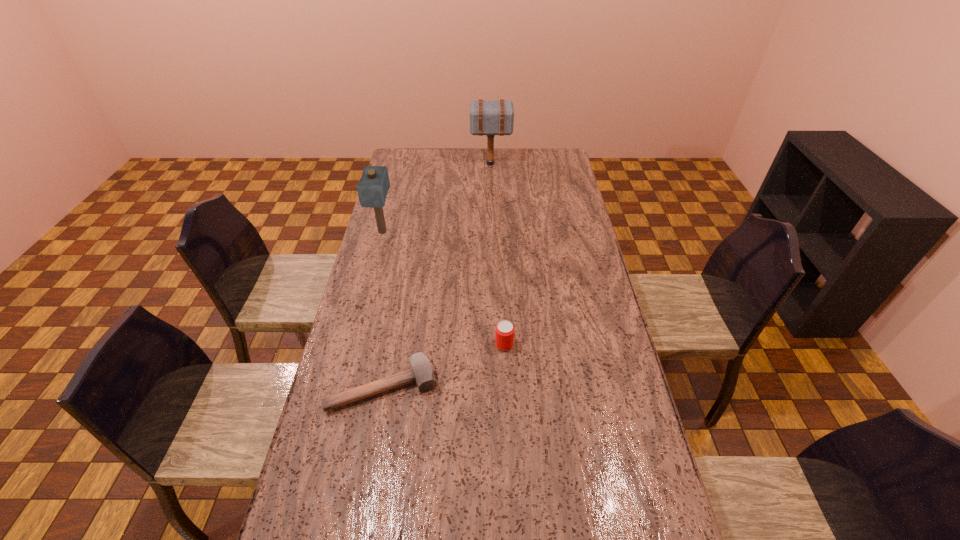
In order to click on vacant space situated on the back of the second farthest object in this screenshot , I will do `click(394, 190)`.

Identify the location of vacant region located on the back of the beer can. The height and width of the screenshot is (540, 960). (502, 307).

Locate an element on the screen. This screenshot has height=540, width=960. free space located on the right of the nearest mallet is located at coordinates (510, 387).

At what (x,y) coordinates should I click in order to perform the action: click on object located in the far edge section of the desktop. Please return your answer as a coordinate pair (x, y). The width and height of the screenshot is (960, 540). Looking at the image, I should click on [487, 117].

Find the location of a particular element. The width and height of the screenshot is (960, 540). vacant space at the far edge of the desktop is located at coordinates (444, 167).

In the image, there is a desktop. Where is `vacant space at the left edge`? vacant space at the left edge is located at coordinates (390, 179).

In the image, there is a desktop. What are the coordinates of `vacant area at the right edge` in the screenshot? It's located at (555, 218).

Locate an element on the screen. This screenshot has height=540, width=960. free area in between the second shortest object and the rightmost mallet is located at coordinates (497, 254).

Locate an element on the screen. The image size is (960, 540). blank region between the second nearest mallet and the nearest mallet is located at coordinates (383, 309).

I want to click on vacant space that's between the second farthest object and the third farthest object, so click(x=444, y=288).